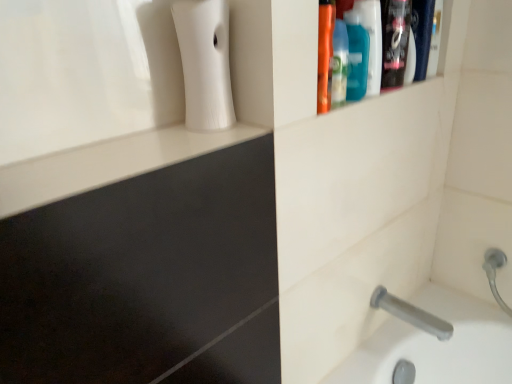
Question: Should I look upward or downward to see gray matte tap at lower right?

Choices:
 (A) down
 (B) up

Answer: (A)

Question: From a real-world perspective, is shiny black bottle at upper right physically above teal plastic mouthwash at upper right, positioned as the first mouthwash in right-to-left order?

Choices:
 (A) no
 (B) yes

Answer: (A)

Question: Is teal plastic mouthwash at upper right, positioned as the first mouthwash in right-to-left order, at the back of shiny black bottle at upper right?

Choices:
 (A) no
 (B) yes

Answer: (A)

Question: Is shiny black bottle at upper right in front of teal plastic mouthwash at upper right, positioned as the first mouthwash in right-to-left order?

Choices:
 (A) yes
 (B) no

Answer: (B)

Question: Is shiny black bottle at upper right at the left side of teal plastic mouthwash at upper right, positioned as the first mouthwash in right-to-left order?

Choices:
 (A) no
 (B) yes

Answer: (A)

Question: Can teal plastic mouthwash at upper right, which is counted as the 2th mouthwash, starting from the left, be found inside shiny black bottle at upper right?

Choices:
 (A) no
 (B) yes

Answer: (A)

Question: Can you confirm if shiny black bottle at upper right is taller than teal plastic mouthwash at upper right, which is counted as the 2th mouthwash, starting from the left?

Choices:
 (A) no
 (B) yes

Answer: (A)

Question: Is teal plastic mouthwash at upper right, which is counted as the 2th mouthwash, starting from the left, far from shiny black bottle at upper right?

Choices:
 (A) yes
 (B) no

Answer: (B)

Question: Is teal plastic mouthwash at upper right, positioned as the first mouthwash in right-to-left order, at the right side of shiny black bottle at upper right?

Choices:
 (A) yes
 (B) no

Answer: (B)

Question: Can you confirm if teal plastic mouthwash at upper right, which is counted as the 2th mouthwash, starting from the left, is taller than shiny black bottle at upper right?

Choices:
 (A) no
 (B) yes

Answer: (B)

Question: Is teal plastic mouthwash at upper right, which is counted as the 2th mouthwash, starting from the left, shorter than shiny black bottle at upper right?

Choices:
 (A) yes
 (B) no

Answer: (B)

Question: Does teal plastic mouthwash at upper right, positioned as the first mouthwash in right-to-left order, have a lesser width compared to shiny black bottle at upper right?

Choices:
 (A) no
 (B) yes

Answer: (A)

Question: From the image's perspective, does teal plastic mouthwash at upper right, positioned as the first mouthwash in right-to-left order, appear lower than shiny black bottle at upper right?

Choices:
 (A) yes
 (B) no

Answer: (A)

Question: Does white matte soap dispenser at upper left have a lesser width compared to translucent plastic mouthwash at upper right, the second mouthwash from the right?

Choices:
 (A) yes
 (B) no

Answer: (B)